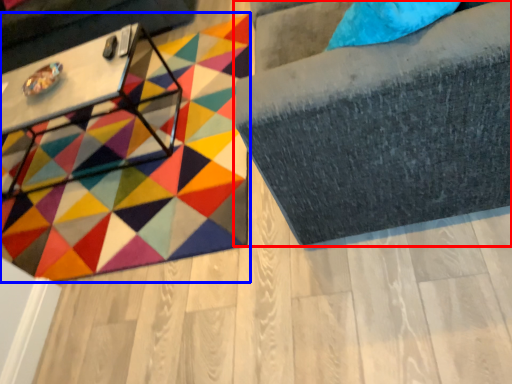
Question: Which of the following is the farthest to the observer, furniture (highlighted by a red box) or mat (highlighted by a blue box)?

Choices:
 (A) furniture
 (B) mat

Answer: (B)